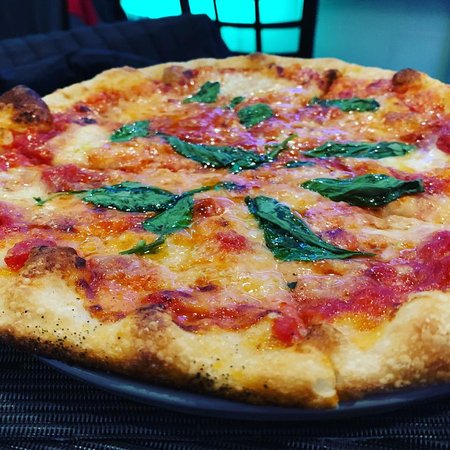
You are a GUI agent. You are given a task and a screenshot of the screen. Output one action in this format:
    pyautogui.click(x=<x>, y=<y>)
    Task: Click on the wall behind pizza
    The width and height of the screenshot is (450, 450).
    Given the screenshot: What is the action you would take?
    pyautogui.click(x=369, y=14)